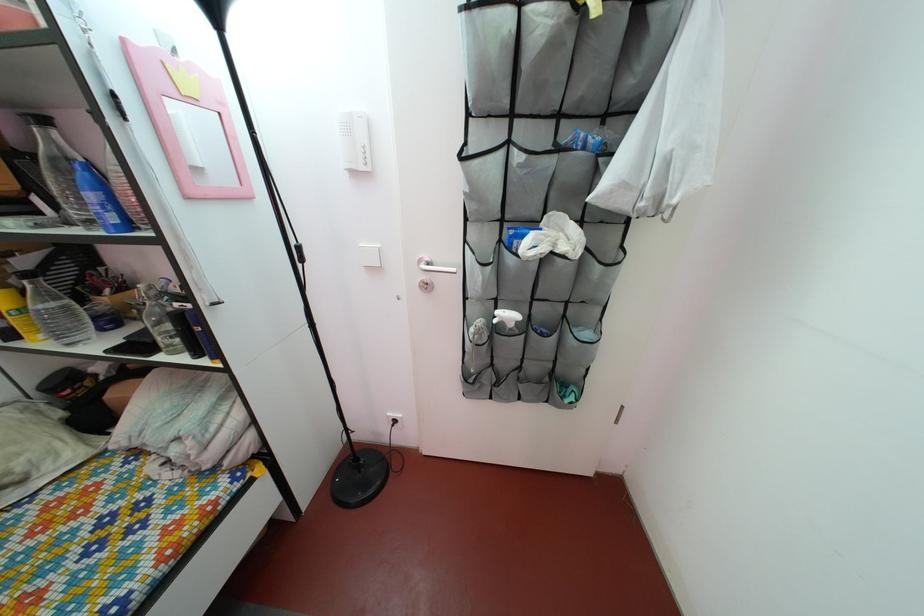
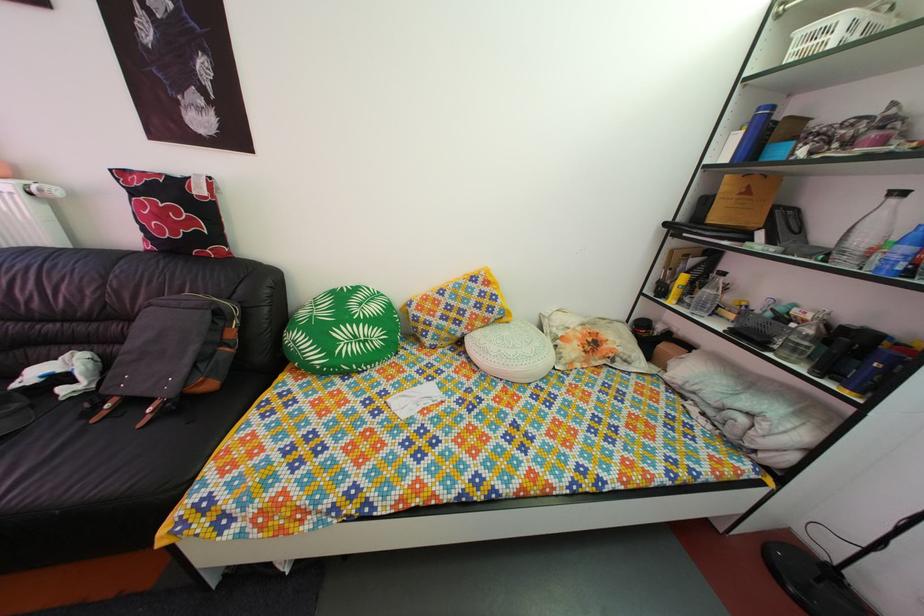
First-person continuous shooting, in which direction is the camera rotating?

The camera rotated toward left-down.